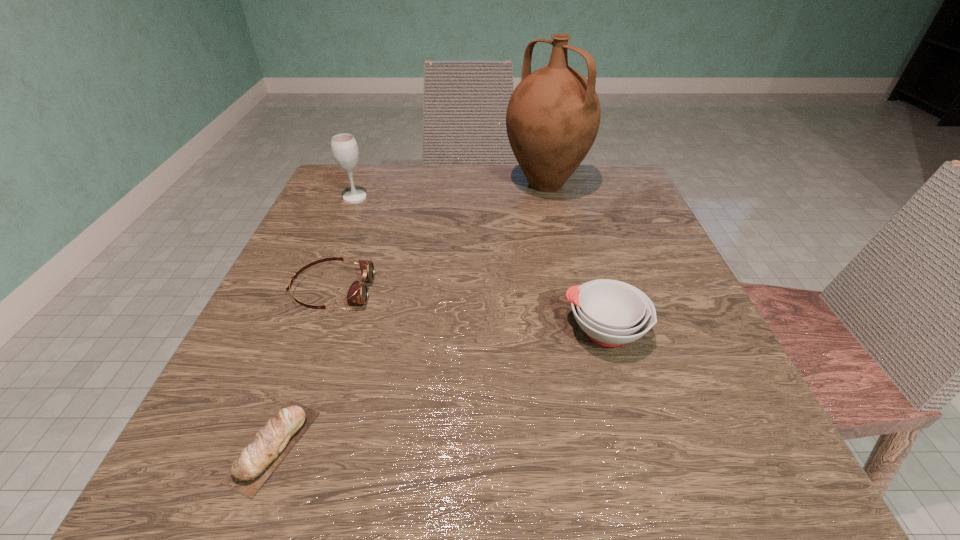
The height and width of the screenshot is (540, 960). In order to click on free space located on the right of the nearest object in this screenshot , I will do `click(492, 446)`.

Locate an element on the screen. Image resolution: width=960 pixels, height=540 pixels. pitcher that is at the far edge is located at coordinates (553, 116).

Locate an element on the screen. The image size is (960, 540). wineglass situated at the far edge is located at coordinates (344, 147).

Where is `object situated at the near edge`? This screenshot has width=960, height=540. object situated at the near edge is located at coordinates (259, 459).

Locate an element on the screen. This screenshot has height=540, width=960. wineglass at the left edge is located at coordinates (344, 147).

You are a GUI agent. You are given a task and a screenshot of the screen. Output one action in this format:
    pyautogui.click(x=<x>, y=<y>)
    Task: Click on the goggles that is positioned at the left edge
    Image resolution: width=960 pixels, height=540 pixels.
    Given the screenshot: What is the action you would take?
    pyautogui.click(x=358, y=293)

Locate an element on the screen. pita bread situated at the left edge is located at coordinates (259, 459).

You are a GUI agent. You are given a task and a screenshot of the screen. Output one action in this format:
    pyautogui.click(x=<x>, y=<y>)
    Task: Click on the pitcher that is at the right edge
    
    Given the screenshot: What is the action you would take?
    pyautogui.click(x=553, y=116)

At what (x,y) coordinates should I click in order to perform the action: click on soup bowl that is at the right edge. Please return your answer as a coordinate pair (x, y). Looking at the image, I should click on (612, 313).

The height and width of the screenshot is (540, 960). I want to click on object situated at the far left corner, so click(x=344, y=147).